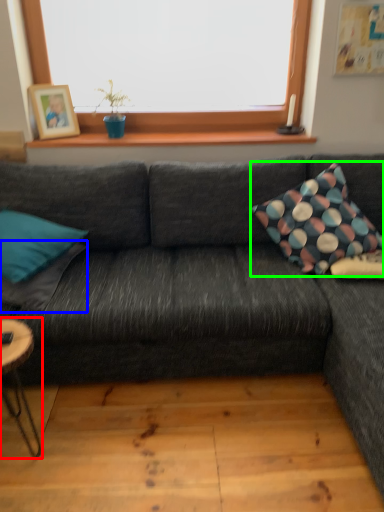
Question: Estimate the real-world distances between objects in this image. Which object is farther from coffee table (highlighted by a red box), pillow (highlighted by a blue box) or pillow (highlighted by a green box)?

Choices:
 (A) pillow
 (B) pillow

Answer: (B)